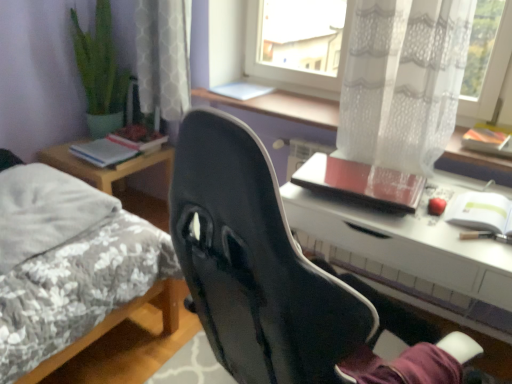
Question: Can white glossy desk at center be found inside fluffy white pillow at left?

Choices:
 (A) yes
 (B) no

Answer: (B)

Question: Considering the relative sizes of fluffy white pillow at left and white glossy desk at center in the image provided, is fluffy white pillow at left bigger than white glossy desk at center?

Choices:
 (A) no
 (B) yes

Answer: (A)

Question: Does fluffy white pillow at left lie behind white glossy desk at center?

Choices:
 (A) yes
 (B) no

Answer: (A)

Question: From the image's perspective, is fluffy white pillow at left over white glossy desk at center?

Choices:
 (A) yes
 (B) no

Answer: (A)

Question: From the image's perspective, is fluffy white pillow at left beneath white glossy desk at center?

Choices:
 (A) no
 (B) yes

Answer: (A)

Question: Considering the relative positions of fluffy white pillow at left and white glossy desk at center in the image provided, is fluffy white pillow at left to the left of white glossy desk at center from the viewer's perspective?

Choices:
 (A) yes
 (B) no

Answer: (A)

Question: From the image's perspective, is fluffy gray bed at left on transparent lace curtain at upper center?

Choices:
 (A) no
 (B) yes

Answer: (A)

Question: Is fluffy gray bed at left to the left of transparent lace curtain at upper center from the viewer's perspective?

Choices:
 (A) yes
 (B) no

Answer: (A)

Question: Is the depth of fluffy gray bed at left greater than that of transparent lace curtain at upper center?

Choices:
 (A) no
 (B) yes

Answer: (A)

Question: Is fluffy gray bed at left wider than transparent lace curtain at upper center?

Choices:
 (A) no
 (B) yes

Answer: (B)

Question: Is fluffy gray bed at left smaller than transparent lace curtain at upper center?

Choices:
 (A) no
 (B) yes

Answer: (A)

Question: Is fluffy gray bed at left next to transparent lace curtain at upper center?

Choices:
 (A) yes
 (B) no

Answer: (B)

Question: Could you tell me if black matte chair at center is turned towards hardcover book at left, which is counted as the first book, starting from the back?

Choices:
 (A) yes
 (B) no

Answer: (B)